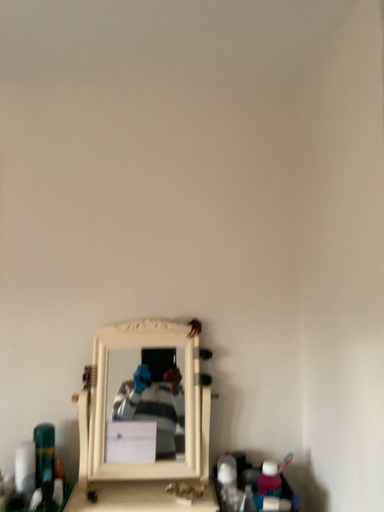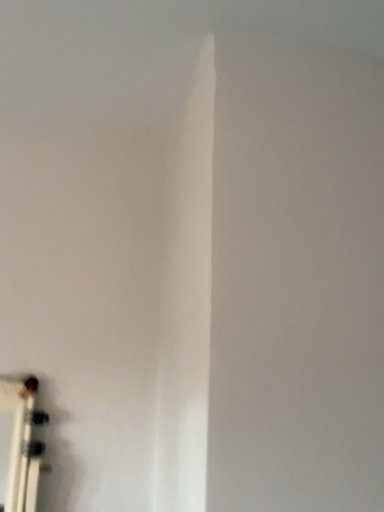
Question: Which way did the camera rotate in the video?

Choices:
 (A) rotated right
 (B) rotated left

Answer: (A)